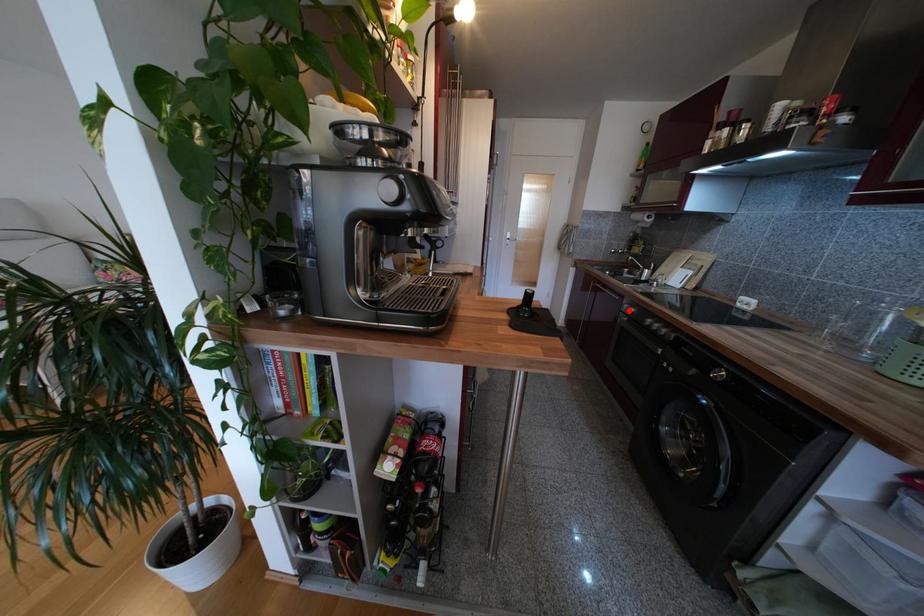
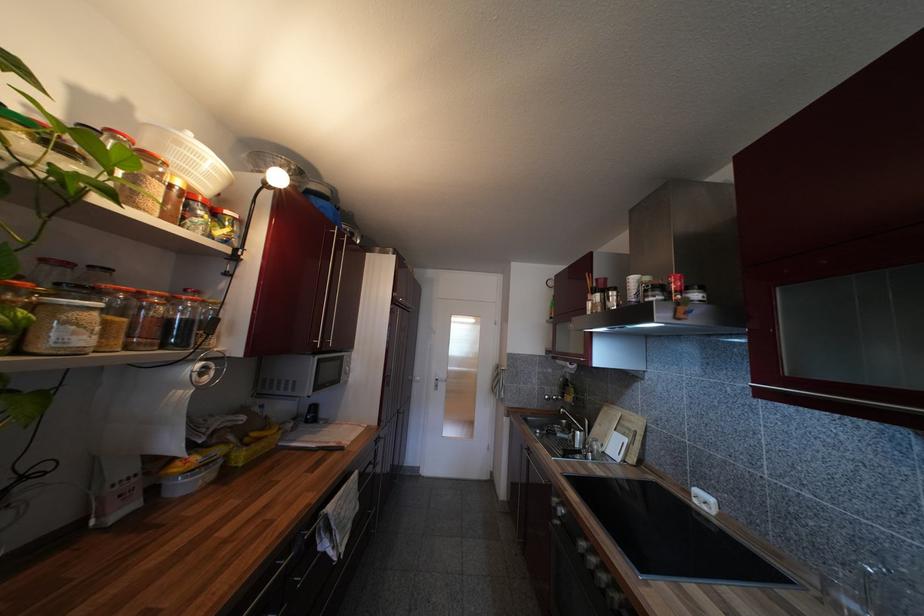
Where in the second image is the point corresponding to the highlighted location from the first image?

(557, 507)